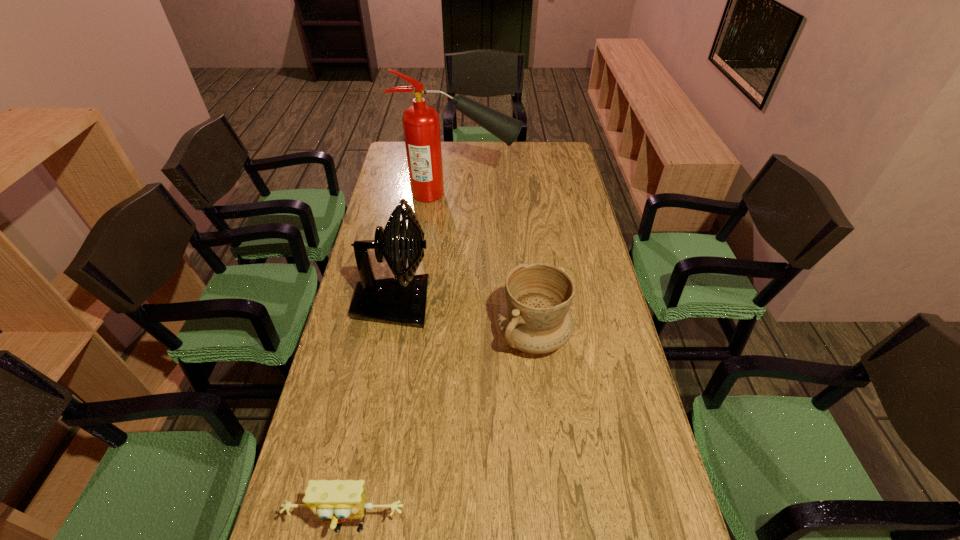
Identify the location of the farthest object. (421, 126).

At what (x,y) coordinates should I click in order to perform the action: click on fire extinguisher. Please return your answer as a coordinate pair (x, y). This screenshot has height=540, width=960. Looking at the image, I should click on (421, 126).

This screenshot has width=960, height=540. In order to click on fan in this screenshot , I will do `click(402, 300)`.

Where is `the third tallest object`? This screenshot has width=960, height=540. the third tallest object is located at coordinates (535, 318).

Identify the location of free spot located 0.130m at the nozzle of the tallest object. (548, 194).

The image size is (960, 540). In order to click on vacant area located 0.190m in front of the third shortest object to blow air in this screenshot , I will do `click(492, 303)`.

Locate an element on the screen. vacant area situated on the left of the second shortest object is located at coordinates (407, 336).

This screenshot has width=960, height=540. Find the location of `fire extinguisher at the left edge`. fire extinguisher at the left edge is located at coordinates (421, 126).

Find the location of `fan that is at the left edge`. fan that is at the left edge is located at coordinates (x=402, y=300).

Where is `object located in the right edge section of the desktop`? The width and height of the screenshot is (960, 540). object located in the right edge section of the desktop is located at coordinates tap(535, 318).